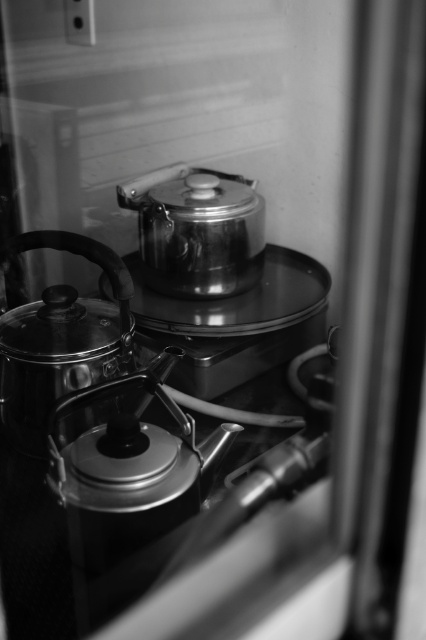
Question: Which object is the closest to the shiny metallic kettle at left?

Choices:
 (A) shiny metallic teapot at center
 (B) shiny metallic pot at center

Answer: (A)

Question: Can you confirm if shiny metallic teapot at center is positioned to the right of shiny metallic kettle at left?

Choices:
 (A) yes
 (B) no

Answer: (A)

Question: From the image, what is the correct spatial relationship of shiny metallic teapot at center in relation to shiny metallic pot at center?

Choices:
 (A) left
 (B) right

Answer: (A)

Question: Which object is the farthest from the shiny metallic pot at center?

Choices:
 (A) shiny metallic kettle at left
 (B) shiny metallic teapot at center

Answer: (B)

Question: Based on their relative distances, which object is nearer to the shiny metallic kettle at left?

Choices:
 (A) shiny metallic teapot at center
 (B) shiny metallic pot at center

Answer: (A)

Question: Considering the relative positions of shiny metallic teapot at center and shiny metallic pot at center in the image provided, where is shiny metallic teapot at center located with respect to shiny metallic pot at center?

Choices:
 (A) left
 (B) right

Answer: (A)